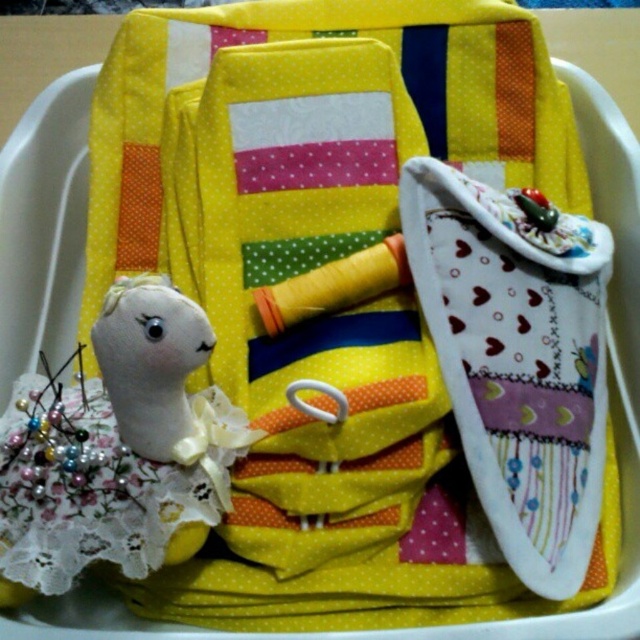
Question: Among these points, which one is farthest from the camera?

Choices:
 (A) (168, 449)
 (B) (138, 509)

Answer: (B)

Question: Is white lace doll at lower left wider than white fabric doll at lower left?

Choices:
 (A) yes
 (B) no

Answer: (A)

Question: Can you confirm if white lace doll at lower left is bigger than white fabric doll at lower left?

Choices:
 (A) no
 (B) yes

Answer: (B)

Question: Which point is closer to the camera taking this photo?

Choices:
 (A) (177, 342)
 (B) (124, 412)

Answer: (A)

Question: In this image, where is white lace doll at lower left located relative to white fabric doll at lower left?

Choices:
 (A) above
 (B) below

Answer: (B)

Question: Which point appears closest to the camera in this image?

Choices:
 (A) (132, 406)
 (B) (36, 445)

Answer: (A)